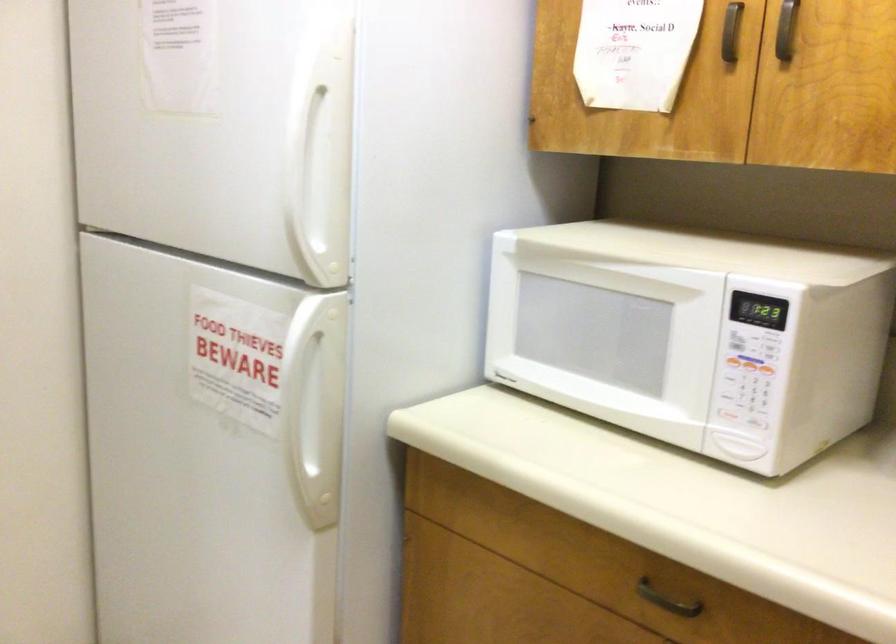
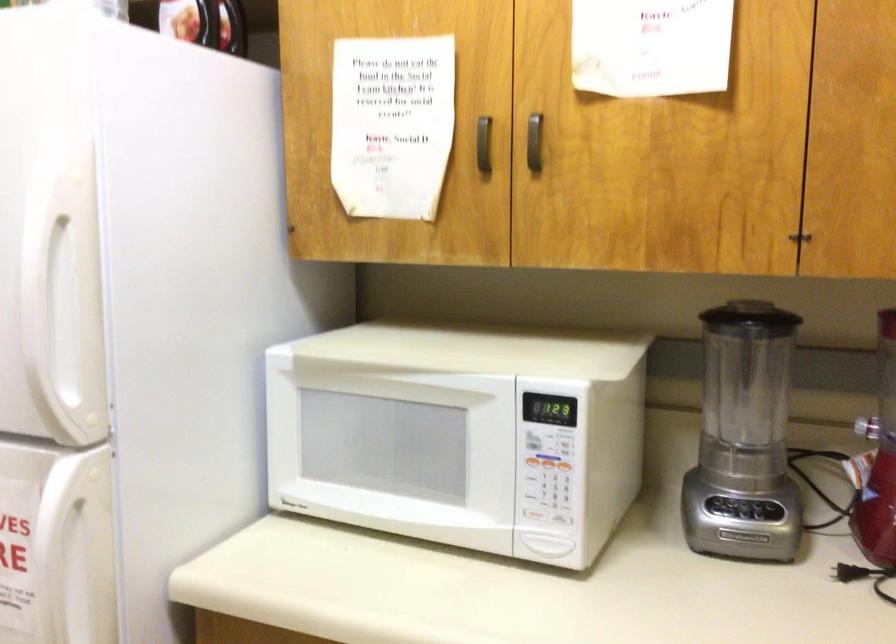
In the second image, find the point that corresponds to (x=297, y=360) in the first image.

(57, 538)